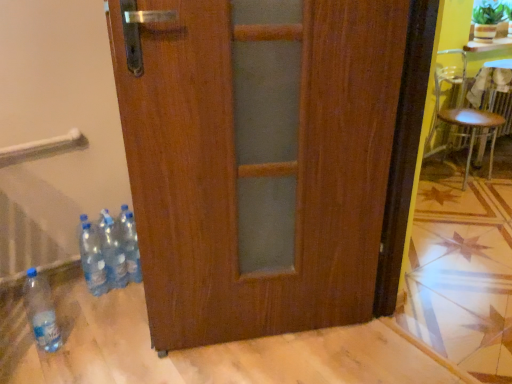
The image size is (512, 384). Identify the location of vacant region to the left of translucent plastic bottles at lower left, the second bottle when ordered from right to left. (71, 296).